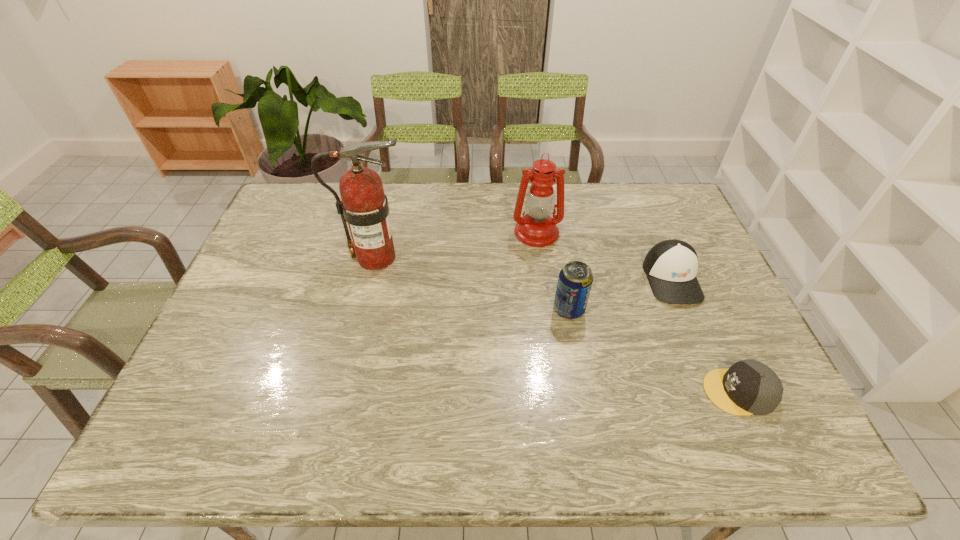
Find the location of a particular element. The height and width of the screenshot is (540, 960). vacant space at the near left corner is located at coordinates (163, 453).

Locate an element on the screen. free region at the far right corner of the desktop is located at coordinates (636, 193).

Find the location of a particular element. vacant space in between the leftmost object and the nearer cap is located at coordinates (558, 325).

Where is `free area in between the third tallest object and the shorter cap`? The height and width of the screenshot is (540, 960). free area in between the third tallest object and the shorter cap is located at coordinates (654, 350).

This screenshot has height=540, width=960. What are the coordinates of `free space between the oil lamp and the leftmost object` in the screenshot? It's located at 456,245.

Locate an element on the screen. free space that is in between the oil lamp and the leftmost object is located at coordinates (456, 245).

Find the location of a particular element. The width and height of the screenshot is (960, 540). vacant area that lies between the second shortest object and the third shortest object is located at coordinates (620, 294).

Find the location of a particular element. The width and height of the screenshot is (960, 540). free spot between the soda and the oil lamp is located at coordinates (553, 271).

At what (x,y) coordinates should I click in order to perform the action: click on free area in between the third shortest object and the second tallest object. Please return your answer as a coordinate pair (x, y). This screenshot has height=540, width=960. Looking at the image, I should click on (553, 271).

The height and width of the screenshot is (540, 960). What are the coordinates of `free spot between the second tallest object and the third tallest object` in the screenshot? It's located at coord(553,271).